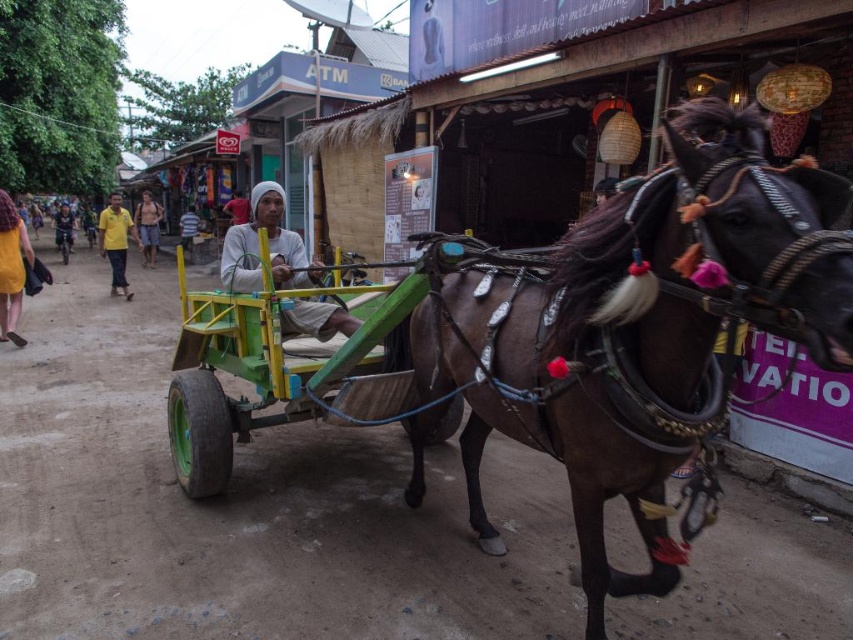
Is point (473, 324) positioned behind point (134, 211)?

No.

Is point (654, 307) closer to viewer compared to point (155, 224)?

Yes, point (654, 307) is in front of point (155, 224).

This screenshot has width=853, height=640. What do you see at coordinates (631, 330) in the screenshot?
I see `brown leather horse at center` at bounding box center [631, 330].

I want to click on brown leather horse at center, so (x=631, y=330).

Is yellow fabric dress at lower left above white striped shirt at center?

No, yellow fabric dress at lower left is not above white striped shirt at center.

Can you confirm if yellow fabric dress at lower left is taller than white striped shirt at center?

Yes, yellow fabric dress at lower left is taller than white striped shirt at center.

Who is more forward, (15, 240) or (180, 216)?

Point (15, 240) is more forward.

This screenshot has height=640, width=853. Find the location of `yellow fabric dress at lower left`. yellow fabric dress at lower left is located at coordinates (10, 268).

Measure the distance from white striped shirt at center to white fabric headscarf at center.

white striped shirt at center is 4.67 meters away from white fabric headscarf at center.

This screenshot has height=640, width=853. What do you see at coordinates (189, 227) in the screenshot?
I see `white striped shirt at center` at bounding box center [189, 227].

Identify the location of white striped shirt at center. The image size is (853, 640). pos(189,227).